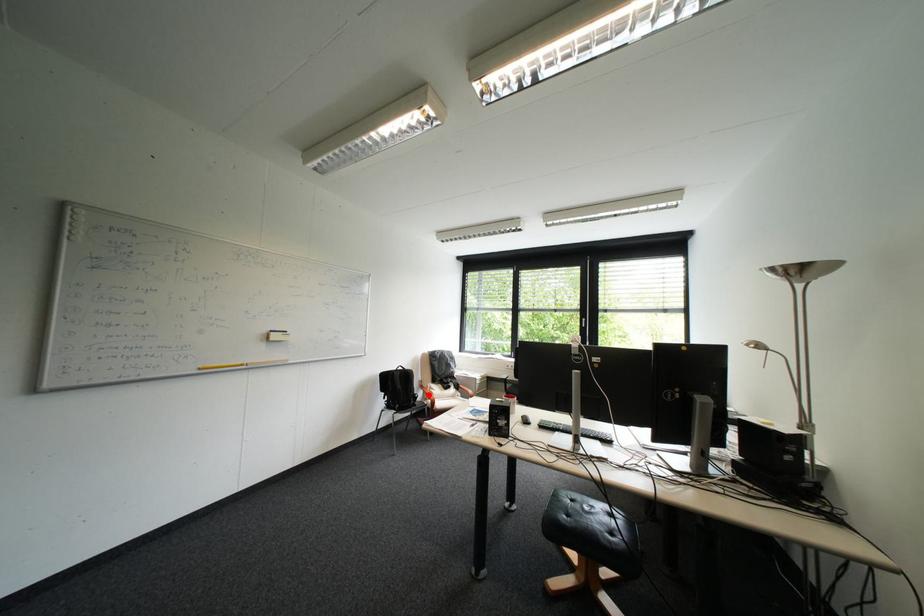
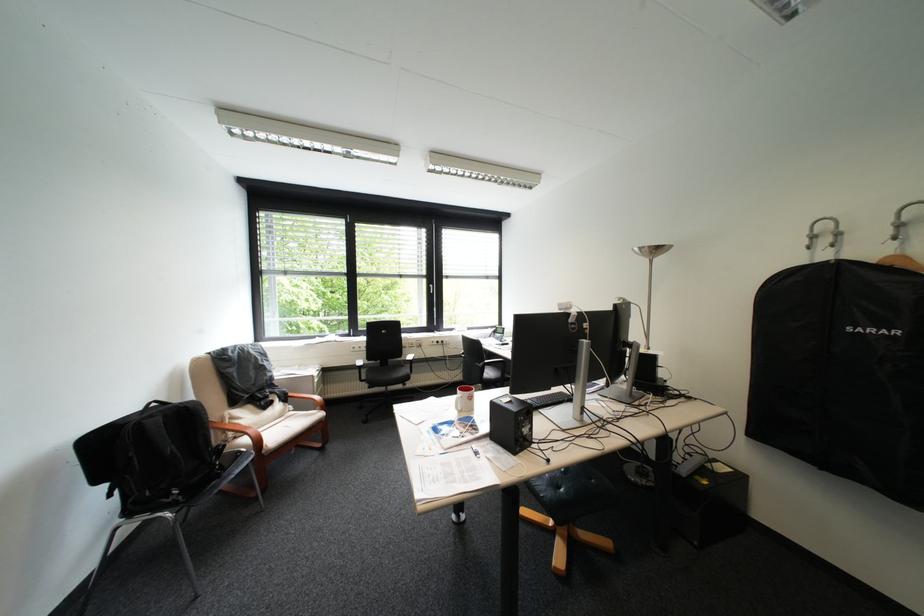
In the second image, find the point that corresponds to the highlighted location in the first image.

(231, 445)